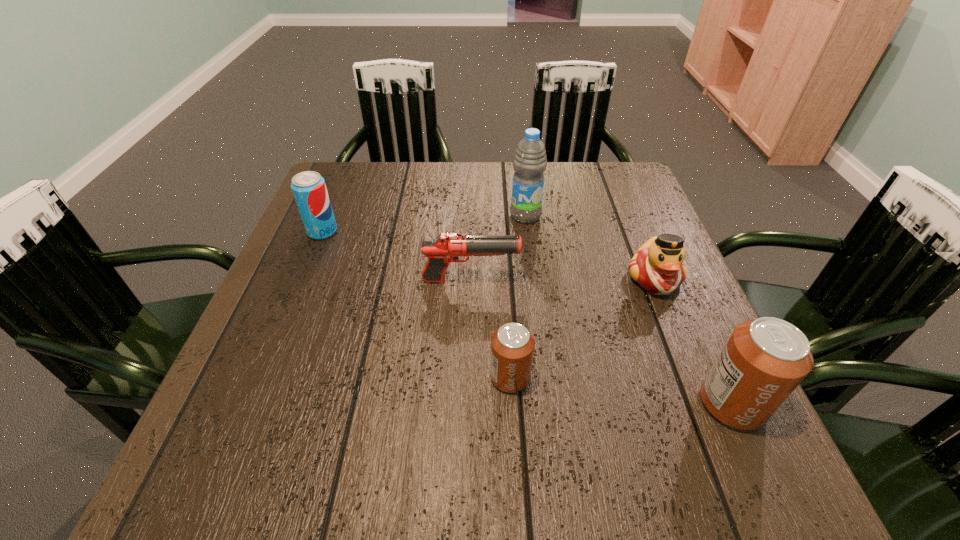
The image size is (960, 540). In order to click on vacant point located between the taller can and the gun in this screenshot , I will do `click(601, 342)`.

The height and width of the screenshot is (540, 960). Identify the location of free space between the duck and the left can. (583, 328).

Locate an element on the screen. vacant region between the tallest object and the second tallest object is located at coordinates (629, 309).

The height and width of the screenshot is (540, 960). Find the location of `free area in between the left can and the duck`. free area in between the left can and the duck is located at coordinates (583, 328).

Locate which object ranks fifth in proximity to the fifth shortest object. Please provide its 2D coordinates. Your answer should be formatted as a tuple, i.e. [(x, y)], where the tuple contains the x and y coordinates of a point satisfying the conditions above.

[(309, 189)]

This screenshot has width=960, height=540. I want to click on object that can be found as the fourth closest to the leftmost object, so 657,266.

I want to click on vacant region that satisfies the following two spatial constraints: 1. at the aiming end of the gun; 2. on the right side of the second tallest object, so click(x=468, y=403).

Where is `vacant space that satisfies the following two spatial constraints: 1. on the face of the fifth shortest object; 2. on the left side of the duck`? This screenshot has height=540, width=960. vacant space that satisfies the following two spatial constraints: 1. on the face of the fifth shortest object; 2. on the left side of the duck is located at coordinates (706, 403).

Locate an element on the screen. blank space that satisfies the following two spatial constraints: 1. at the aiming end of the left can; 2. on the left side of the gun is located at coordinates (468, 377).